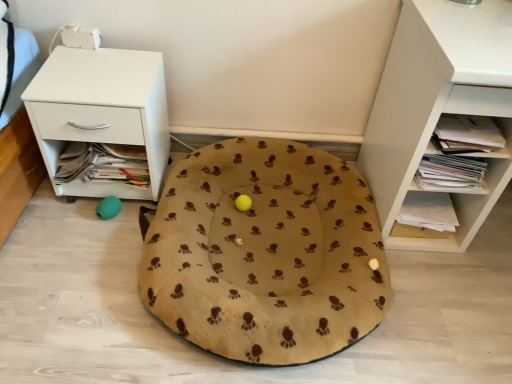
In order to click on vacant area that lies between white matte shelf at right and beige fabric dog bed at center in this screenshot , I will do `click(444, 310)`.